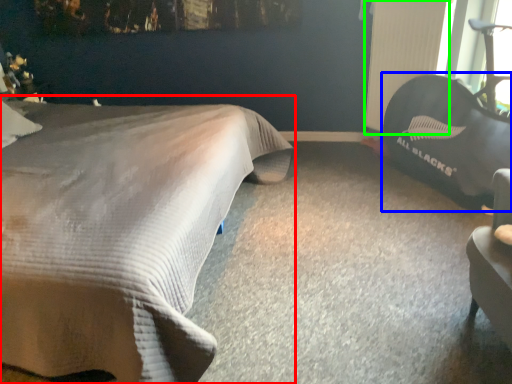
Question: Considering the real-world distances, which object is farthest from bed (highlighted by a red box)? bean bag chair (highlighted by a blue box) or radiator (highlighted by a green box)?

Choices:
 (A) bean bag chair
 (B) radiator

Answer: (B)